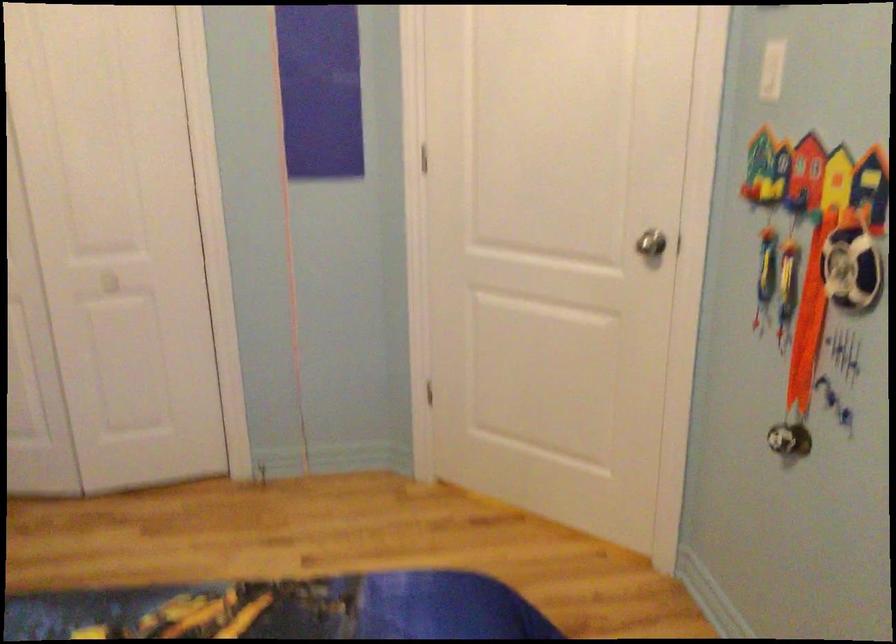
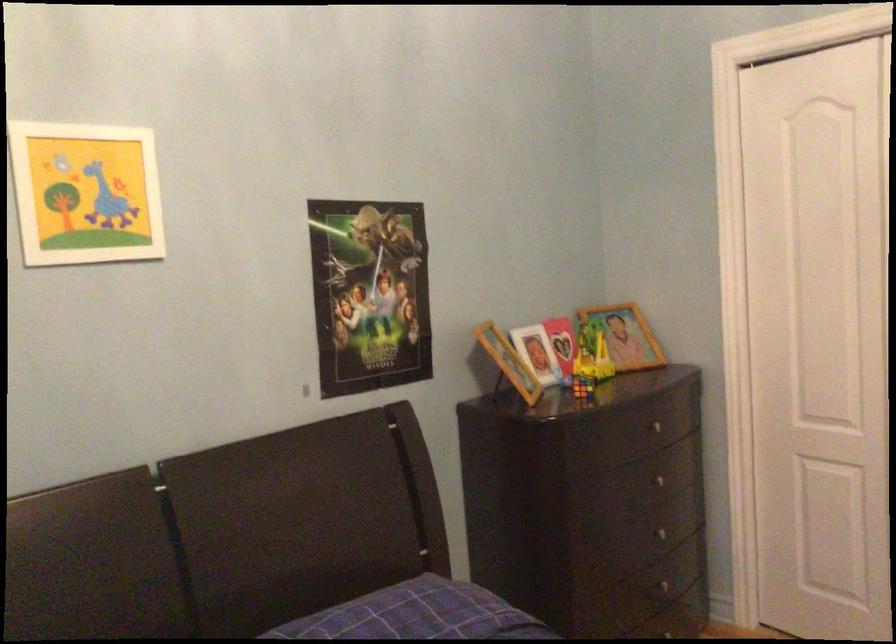
Question: The camera is either moving clockwise (left) or counter-clockwise (right) around the object. The first image is from the beginning of the video and the second image is from the end. Is the camera moving left or right when shooting the video?

Choices:
 (A) Left
 (B) Right

Answer: (B)